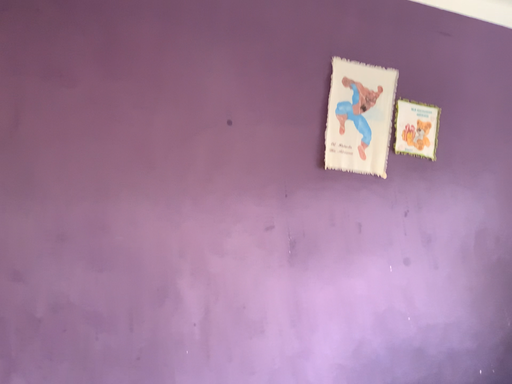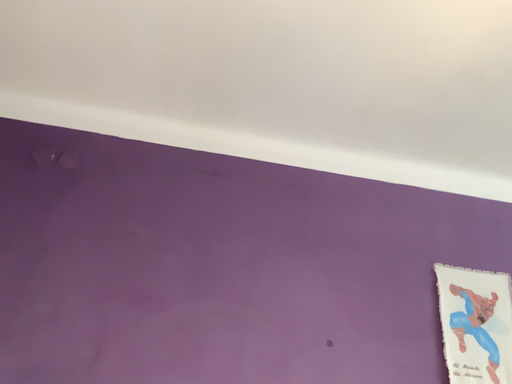
Question: How did the camera likely rotate when shooting the video?

Choices:
 (A) rotated downward
 (B) rotated upward

Answer: (B)